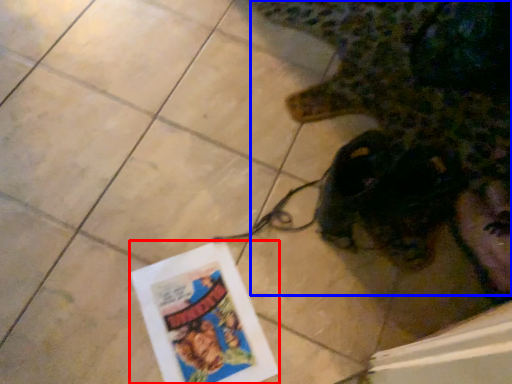
Question: Which point is closer to the camera, flyer (highlighted by a red box) or animal (highlighted by a blue box)?

Choices:
 (A) flyer
 (B) animal

Answer: (B)